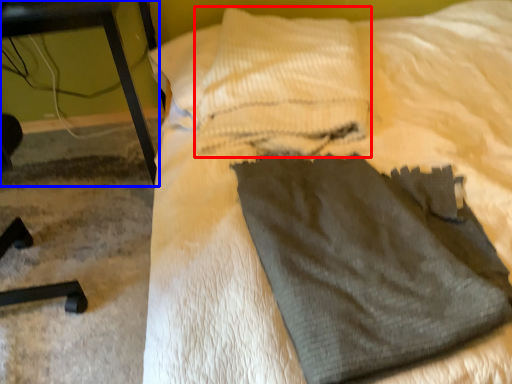
Question: Among these objects, which one is farthest to the camera, pillow (highlighted by a red box) or furniture (highlighted by a blue box)?

Choices:
 (A) pillow
 (B) furniture

Answer: (A)